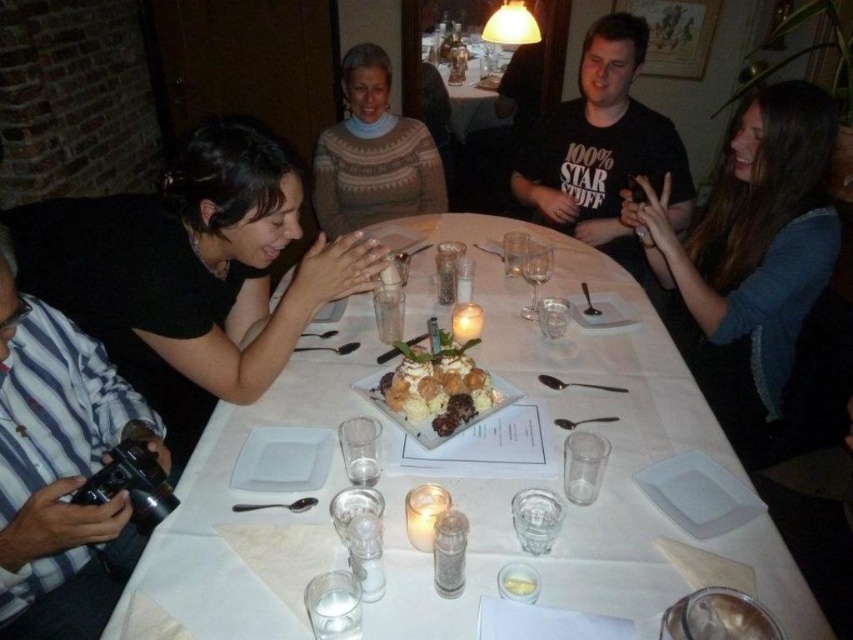
Does black cotton t-shirt at center appear under chocolate cake with whipped cream at center?

Incorrect, black cotton t-shirt at center is not positioned below chocolate cake with whipped cream at center.

From the picture: Does black cotton t-shirt at center appear on the right side of chocolate cake with whipped cream at center?

Yes, black cotton t-shirt at center is to the right of chocolate cake with whipped cream at center.

This screenshot has width=853, height=640. What do you see at coordinates (602, 147) in the screenshot?
I see `black cotton t-shirt at center` at bounding box center [602, 147].

Where is `black cotton t-shirt at center`? The height and width of the screenshot is (640, 853). black cotton t-shirt at center is located at coordinates (602, 147).

Does blue sweater at upper right have a smaller size compared to brown knitted sweater at center?

No.

Does point (816, 157) come in front of point (437, 170)?

Yes, it is in front of point (437, 170).

Identify the location of blue sweater at upper right. This screenshot has height=640, width=853. (749, 257).

Between point (705, 339) and point (683, 488), which one is positioned in front?

Point (683, 488)

Who is positioned more to the right, blue sweater at upper right or white matte plate at lower right?

From the viewer's perspective, blue sweater at upper right appears more on the right side.

The image size is (853, 640). I want to click on blue sweater at upper right, so click(749, 257).

Locate an element on the screen. The image size is (853, 640). blue sweater at upper right is located at coordinates (749, 257).